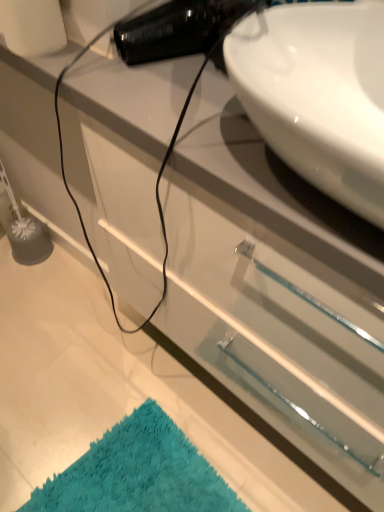
Describe the element at coordinates (318, 95) in the screenshot. The width and height of the screenshot is (384, 512). I see `white glossy sink at upper right` at that location.

What is the approximate height of white glossy sink at upper right?

white glossy sink at upper right is 4.60 inches in height.

You are a GUI agent. You are given a task and a screenshot of the screen. Output one action in this format:
    pyautogui.click(x=<x>, y=<y>)
    Task: Click on the white glossy sink at upper right
    The height and width of the screenshot is (512, 384).
    Given the screenshot: What is the action you would take?
    pyautogui.click(x=318, y=95)

The width and height of the screenshot is (384, 512). In order to click on teal shaggy bath mat at lower left in this screenshot , I will do `click(138, 473)`.

In order to face teal shaggy bath mat at lower left, should I rotate leftwards or rightwards?

Turn left approximately 8.164 degrees to face it.

Describe the element at coordinates (138, 473) in the screenshot. I see `teal shaggy bath mat at lower left` at that location.

Find the location of a particular element. The image size is (384, 512). white glossy sink at upper right is located at coordinates [318, 95].

Consider the image. Considering the relative positions of white glossy sink at upper right and teal shaggy bath mat at lower left in the image provided, is white glossy sink at upper right to the right of teal shaggy bath mat at lower left from the viewer's perspective?

Yes.

Is white glossy sink at upper right in front of or behind teal shaggy bath mat at lower left in the image?

Clearly, white glossy sink at upper right is in front of teal shaggy bath mat at lower left.

Between point (258, 104) and point (153, 475), which one is positioned behind?

The point (153, 475) is more distant.

From the image's perspective, which one is positioned higher, white glossy sink at upper right or teal shaggy bath mat at lower left?

white glossy sink at upper right is shown above in the image.

From a real-world perspective, which object stands above the other?

From a 3D spatial view, white glossy sink at upper right is above.

Looking at their sizes, would you say white glossy sink at upper right is wider or thinner than teal shaggy bath mat at lower left?

Considering their sizes, white glossy sink at upper right looks broader than teal shaggy bath mat at lower left.

Considering the sizes of objects white glossy sink at upper right and teal shaggy bath mat at lower left in the image provided, who is shorter, white glossy sink at upper right or teal shaggy bath mat at lower left?

teal shaggy bath mat at lower left.

Is white glossy sink at upper right bigger than teal shaggy bath mat at lower left?

Yes, white glossy sink at upper right is bigger than teal shaggy bath mat at lower left.

Is teal shaggy bath mat at lower left completely or partially inside white glossy sink at upper right?

No, teal shaggy bath mat at lower left is not surrounded by white glossy sink at upper right.

Is white glossy sink at upper right directly adjacent to teal shaggy bath mat at lower left?

No.

Does white glossy sink at upper right turn towards teal shaggy bath mat at lower left?

No.

How different are the orientations of white glossy sink at upper right and teal shaggy bath mat at lower left in degrees?

white glossy sink at upper right and teal shaggy bath mat at lower left are facing 99 degrees away from each other.

Find the location of a particular element. The height and width of the screenshot is (512, 384). bath mat below the white glossy sink at upper right (from the image's perspective) is located at coordinates (138, 473).

Can you confirm if teal shaggy bath mat at lower left is positioned to the right of white glossy sink at upper right?

No, teal shaggy bath mat at lower left is not to the right of white glossy sink at upper right.

Does teal shaggy bath mat at lower left come in front of white glossy sink at upper right?

No, it is behind white glossy sink at upper right.

Considering the points (172, 421) and (382, 128), which point is behind, point (172, 421) or point (382, 128)?

The point (172, 421) is farther from the camera.

From the image's perspective, is teal shaggy bath mat at lower left located above or below white glossy sink at upper right?

Based on their image positions, teal shaggy bath mat at lower left is located beneath white glossy sink at upper right.

From a real-world perspective, relative to white glossy sink at upper right, is teal shaggy bath mat at lower left vertically above or below?

teal shaggy bath mat at lower left is below white glossy sink at upper right.

Considering the relative sizes of teal shaggy bath mat at lower left and white glossy sink at upper right in the image provided, is teal shaggy bath mat at lower left wider than white glossy sink at upper right?

Incorrect, the width of teal shaggy bath mat at lower left does not surpass that of white glossy sink at upper right.

Considering the relative sizes of teal shaggy bath mat at lower left and white glossy sink at upper right in the image provided, is teal shaggy bath mat at lower left taller than white glossy sink at upper right?

No.

Is teal shaggy bath mat at lower left bigger than white glossy sink at upper right?

No.

Choose the correct answer: Is teal shaggy bath mat at lower left inside white glossy sink at upper right or outside it?

teal shaggy bath mat at lower left lies outside white glossy sink at upper right.

Would you say teal shaggy bath mat at lower left is a long distance from white glossy sink at upper right?

No, teal shaggy bath mat at lower left is in close proximity to white glossy sink at upper right.

Is teal shaggy bath mat at lower left facing towards white glossy sink at upper right?

No.

What's the angular difference between teal shaggy bath mat at lower left and white glossy sink at upper right's facing directions?

teal shaggy bath mat at lower left and white glossy sink at upper right are facing 99 degrees away from each other.

Find the location of a particular element. The image size is (384, 512). bath mat that is behind the white glossy sink at upper right is located at coordinates (138, 473).

Image resolution: width=384 pixels, height=512 pixels. In order to click on sink in front of the teal shaggy bath mat at lower left in this screenshot , I will do `click(318, 95)`.

You are a GUI agent. You are given a task and a screenshot of the screen. Output one action in this format:
    pyautogui.click(x=<x>, y=<y>)
    Task: Click on the sink that is on the right side of teal shaggy bath mat at lower left
    
    Given the screenshot: What is the action you would take?
    pyautogui.click(x=318, y=95)